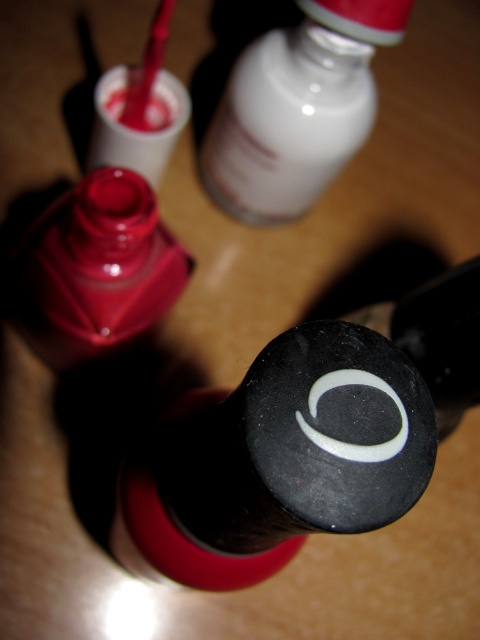
You have a storage box that can only fit items wider than 10 cm. Based on the scene, can the white glossy bottle at upper center and the matte red nail polish at center both fit into the box?

The white glossy bottle at upper center might be wider than matte red nail polish at center, but since the exact width of the white glossy bottle at upper center is not provided, we cannot confirm if it exceeds 10 cm. The matte red nail polish at center may or may not meet the width requirement without specific measurements. Therefore, it is uncertain if both items can fit into the storage box.

You are trying to locate the white glossy bottle at upper center in the image. What are the coordinates where you should look?

The white glossy bottle at upper center is located at coordinates point (297, 108).